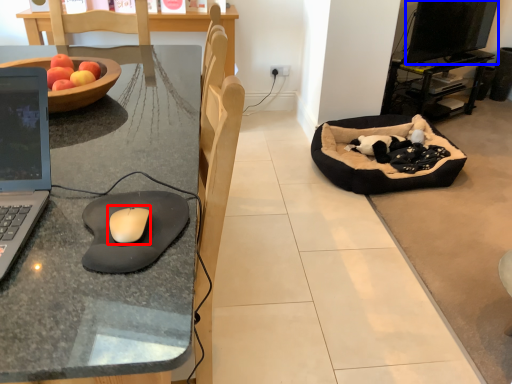
Question: Among these objects, which one is farthest to the camera, mouse (highlighted by a red box) or computer monitor (highlighted by a blue box)?

Choices:
 (A) mouse
 (B) computer monitor

Answer: (B)